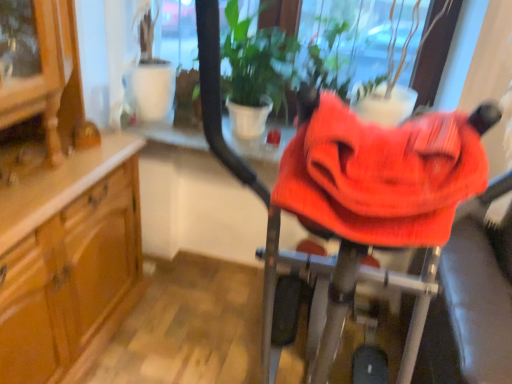
Question: In the image, is knitted fabric baby carriage at center on the left side or the right side of green leafy plant at center?

Choices:
 (A) right
 (B) left

Answer: (A)

Question: Is knitted fabric baby carriage at center taller or shorter than green leafy plant at center?

Choices:
 (A) short
 (B) tall

Answer: (A)

Question: From the image's perspective, relative to green leafy plant at center, is knitted fabric baby carriage at center above or below?

Choices:
 (A) above
 (B) below

Answer: (B)

Question: From a real-world perspective, is green leafy plant at center physically located above or below knitted fabric baby carriage at center?

Choices:
 (A) below
 (B) above

Answer: (A)

Question: Considering the positions of green leafy plant at center and knitted fabric baby carriage at center in the image, is green leafy plant at center taller or shorter than knitted fabric baby carriage at center?

Choices:
 (A) short
 (B) tall

Answer: (B)

Question: Is point (247, 76) positioned closer to the camera than point (334, 276)?

Choices:
 (A) farther
 (B) closer

Answer: (A)

Question: From the image's perspective, is green leafy plant at center located above or below knitted fabric baby carriage at center?

Choices:
 (A) below
 (B) above

Answer: (B)